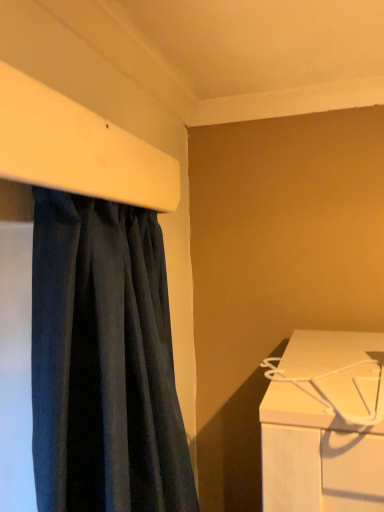
Describe the element at coordinates (104, 362) in the screenshot. I see `dark blue fabric at left` at that location.

This screenshot has height=512, width=384. Identify the location of dark blue fabric at left. point(104,362).

Locate an element on the screen. The height and width of the screenshot is (512, 384). dark blue fabric at left is located at coordinates (104, 362).